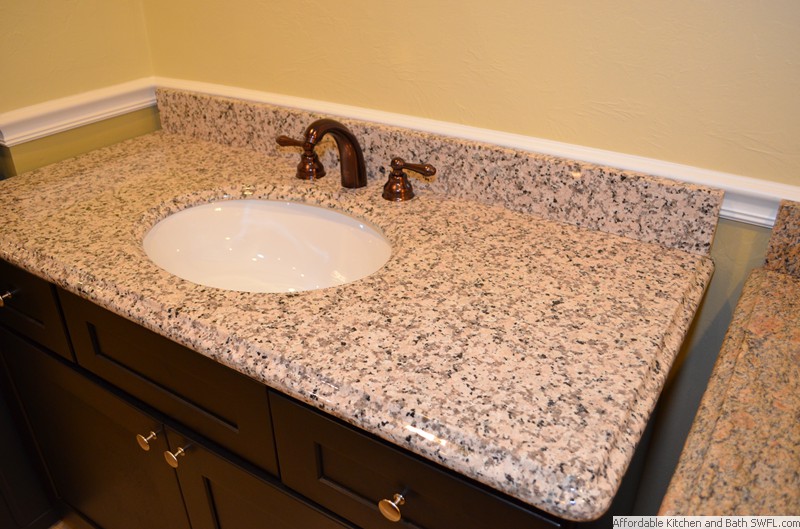
Identify the location of backslpash. click(x=612, y=206).